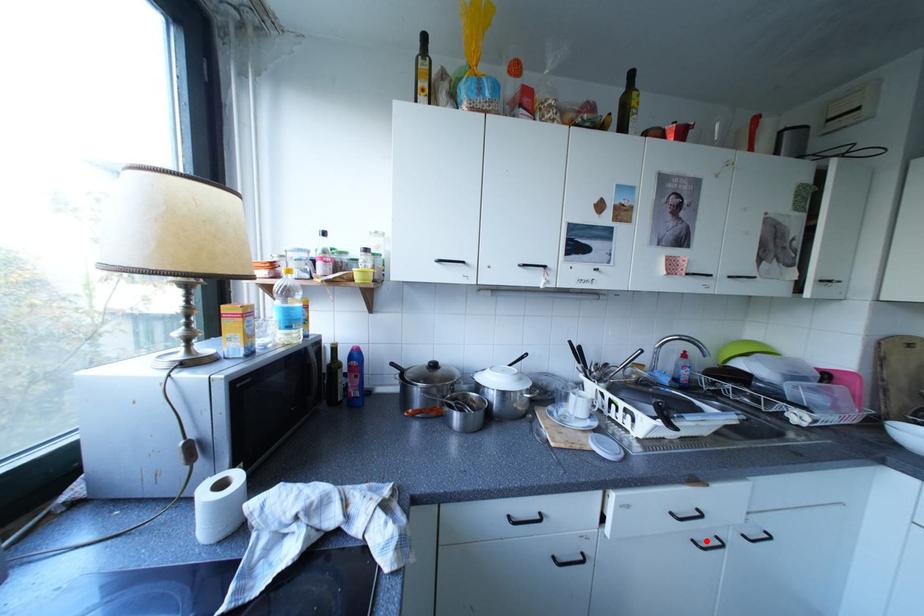
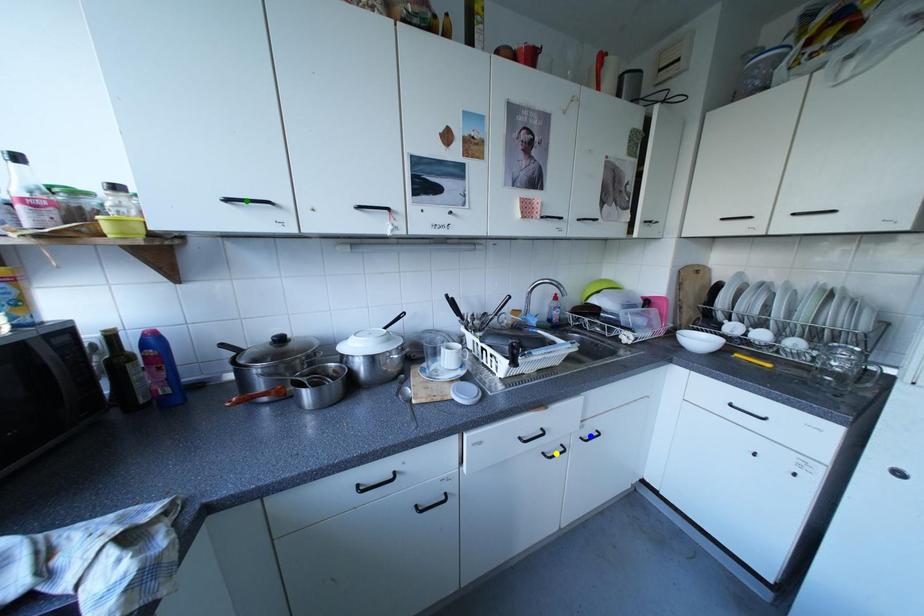
Question: I am providing you with two images of the same scene from different viewpoints. A red point is marked on the first image. You are given multiple points on the second image. Which mark in image 2 goes with the point in image 1?

Choices:
 (A) blue point
 (B) yellow point
 (C) green point

Answer: (B)